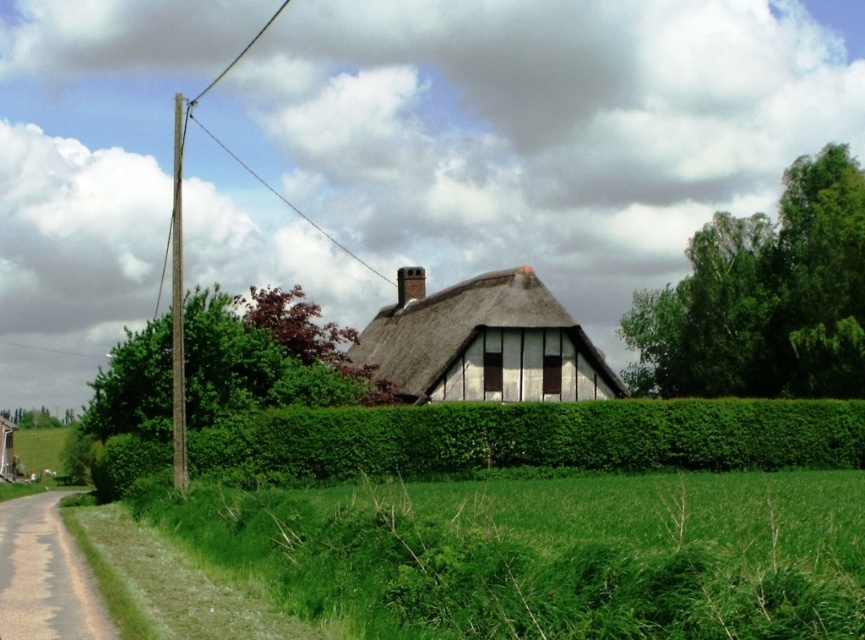
Who is positioned more to the right, green leafy hedge at center or thatched roof at center?

green leafy hedge at center

Does green leafy hedge at center have a greater height compared to thatched roof at center?

Incorrect, green leafy hedge at center's height is not larger of thatched roof at center's.

Find the location of a particular element. green leafy hedge at center is located at coordinates point(529,438).

Where is `green leafy hedge at center`? The width and height of the screenshot is (865, 640). green leafy hedge at center is located at coordinates (529, 438).

Can you confirm if green grass at lower left is positioned below green leafy hedge at center?

No, green grass at lower left is not below green leafy hedge at center.

Between green grass at lower left and green leafy hedge at center, which one appears on the left side from the viewer's perspective?

green leafy hedge at center is more to the left.

Between point (580, 561) and point (280, 420), which one is positioned behind?

Point (280, 420)

Where is `green grass at lower left`? The width and height of the screenshot is (865, 640). green grass at lower left is located at coordinates (545, 554).

At what (x,y) coordinates should I click in order to perform the action: click on green grass at lower left. Please return your answer as a coordinate pair (x, y). Looking at the image, I should click on (545, 554).

Between green grass at lower left and thatched roof at center, which one appears on the right side from the viewer's perspective?

From the viewer's perspective, green grass at lower left appears more on the right side.

Is point (443, 493) positioned in front of point (524, 342)?

Yes, point (443, 493) is closer to viewer.

I want to click on green grass at lower left, so click(545, 554).